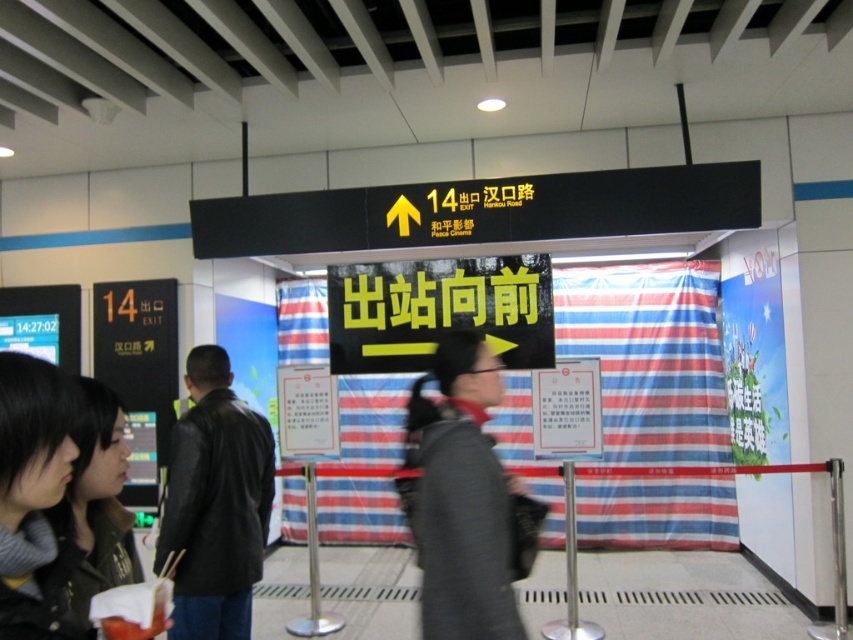
Does dark gray jacket at center have a larger size compared to black leather jacket at left?

Indeed, dark gray jacket at center has a larger size compared to black leather jacket at left.

I want to click on dark gray jacket at center, so click(x=460, y=497).

Which is in front, point (477, 612) or point (225, 545)?

Positioned in front is point (477, 612).

At what (x,y) coordinates should I click in order to perform the action: click on dark gray jacket at center. Please return your answer as a coordinate pair (x, y). The height and width of the screenshot is (640, 853). Looking at the image, I should click on (460, 497).

Between dark gray sweater at lower left and dark brown leather jacket at lower left, which one has less height?

dark gray sweater at lower left

Does dark gray sweater at lower left have a greater width compared to dark brown leather jacket at lower left?

No, dark gray sweater at lower left is not wider than dark brown leather jacket at lower left.

Between point (50, 424) and point (90, 428), which one is positioned in front?

Positioned in front is point (50, 424).

You are a GUI agent. You are given a task and a screenshot of the screen. Output one action in this format:
    pyautogui.click(x=<x>, y=<y>)
    Task: Click on the dark gray sweater at lower left
    This screenshot has width=853, height=640.
    Given the screenshot: What is the action you would take?
    pyautogui.click(x=33, y=497)

Is dark gray jacket at center positioned at the back of dark gray sweater at lower left?

Yes, it is.

In order to click on dark gray jacket at center in this screenshot , I will do `click(460, 497)`.

Between point (440, 349) and point (39, 465), which one is positioned in front?

Point (39, 465) is in front.

The width and height of the screenshot is (853, 640). In order to click on dark gray jacket at center in this screenshot , I will do `click(460, 497)`.